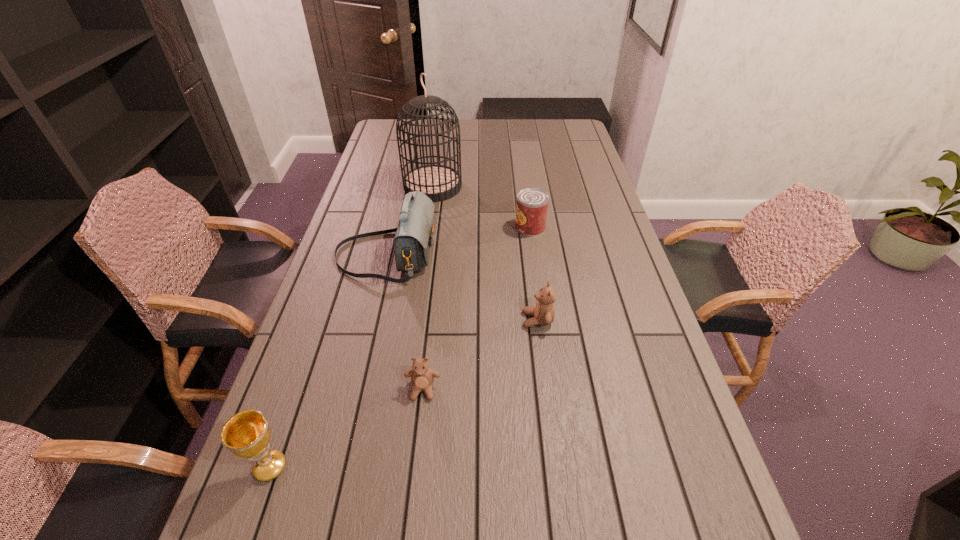
Locate an element on the screen. The image size is (960, 540). the left teddy bear is located at coordinates (422, 377).

Find the location of a particular element. Image resolution: width=960 pixels, height=540 pixels. the second nearest object is located at coordinates click(422, 377).

Locate an element on the screen. the third nearest object is located at coordinates (543, 313).

I want to click on the farther teddy bear, so click(543, 313).

What are the coordinates of `the fifth shortest object` in the screenshot? It's located at (413, 239).

This screenshot has width=960, height=540. I want to click on birdcage, so click(x=438, y=182).

Where is `the tallest object`? the tallest object is located at coordinates (438, 182).

This screenshot has width=960, height=540. What are the coordinates of `can` in the screenshot? It's located at (532, 203).

This screenshot has height=540, width=960. Identify the location of chalice. (247, 434).

Locate an element on the screen. The height and width of the screenshot is (540, 960). the nearest object is located at coordinates (247, 434).